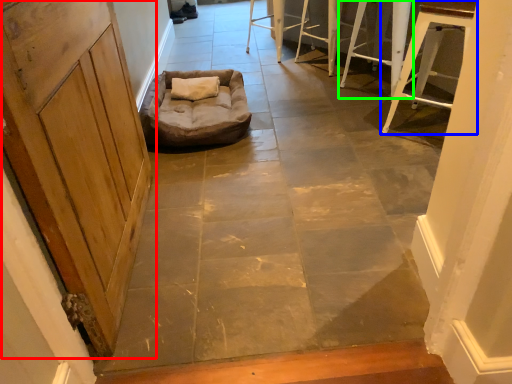
Question: Which object is the farthest from door (highlighted by a red box)? Choose among these: furniture (highlighted by a blue box) or furniture (highlighted by a green box).

Choices:
 (A) furniture
 (B) furniture

Answer: (B)